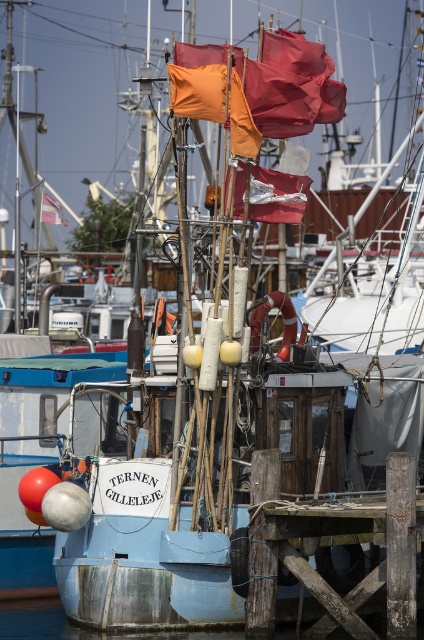
You are standing on the wooden pier where the fishing boat is docked. You notice the weathered wood dock at lower right and the orange fabric flag at upper center. From your position on the pier, which object is positioned to the right of the other?

The weathered wood dock at lower right is to the right of the orange fabric flag at upper center.

You are a sailor on the fishing boat Ternen Gilleleje and need to retrieve a flag from the mast. You notice the orange fabric flags at upper center and the shiny silver flag at center. Which flag is positioned to the left when facing the mast?

The orange fabric flags at upper center is positioned to the left of the shiny silver flag at center.